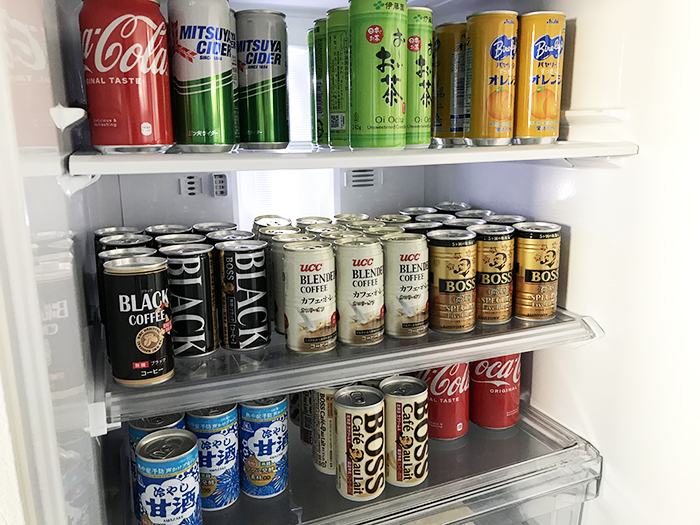
Where is `shelf`? The image size is (700, 525). shelf is located at coordinates (491, 457), (475, 348), (425, 157).